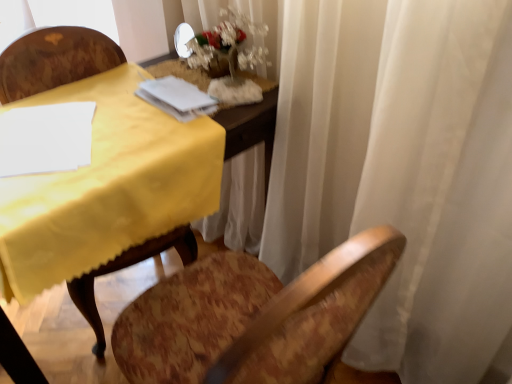
What do you see at coordinates (229, 44) in the screenshot? I see `white frosted glass vase at upper center` at bounding box center [229, 44].

Looking at this image, in order to face wooden chair at left, should I rotate leftwards or rightwards?

To face it directly, rotate left by 20.212 degrees.

At what (x,y) coordinates should I click in order to perform the action: click on white frosted glass vase at upper center. Please return your answer as a coordinate pair (x, y). Image resolution: width=512 pixels, height=384 pixels. Looking at the image, I should click on (229, 44).

Is white paper at upper center looking in the opposite direction of white frosted glass vase at upper center?

Yes, white paper at upper center is facing away from white frosted glass vase at upper center.

Looking at their sizes, would you say white paper at upper center is wider or thinner than white frosted glass vase at upper center?

white paper at upper center is thinner than white frosted glass vase at upper center.

Measure the distance between white paper at upper center and white frosted glass vase at upper center.

They are 5.42 inches apart.

In order to click on notebook beneath the white frosted glass vase at upper center (from a real-world perspective) in this screenshot , I will do `click(177, 98)`.

Which object is closer to the camera taking this photo, white frosted glass vase at upper center or white paper at upper center?

white paper at upper center is closer to the camera.

Is white frosted glass vase at upper center to the right of white paper at upper center from the viewer's perspective?

Yes, white frosted glass vase at upper center is to the right of white paper at upper center.

Find the location of a particular element. Image resolution: width=512 pixels, height=384 pixels. chair to the left of white frosted glass vase at upper center is located at coordinates (54, 60).

From a real-world perspective, is wooden chair at left below white frosted glass vase at upper center?

Yes, from a real-world perspective, wooden chair at left is beneath white frosted glass vase at upper center.

Would you say wooden chair at left is inside or outside white frosted glass vase at upper center?

wooden chair at left cannot be found inside white frosted glass vase at upper center.

Considering the positions of objects white paper at upper center and wooden chair at left in the image provided, who is more to the left, white paper at upper center or wooden chair at left?

wooden chair at left is more to the left.

Does white paper at upper center turn towards wooden chair at left?

Yes, white paper at upper center is aimed at wooden chair at left.

Is white paper at upper center taller or shorter than wooden chair at left?

Considering their sizes, white paper at upper center has less height than wooden chair at left.

Is white paper at upper center bigger than wooden chair at left?

No, white paper at upper center is not bigger than wooden chair at left.

Is there a large distance between white frosted glass vase at upper center and wooden chair at left?

No, there isn't a large distance between white frosted glass vase at upper center and wooden chair at left.

From the image's perspective, between white frosted glass vase at upper center and wooden chair at left, who is located below?

wooden chair at left is shown below in the image.

Considering their positions, is white frosted glass vase at upper center located in front of or behind wooden chair at left?

white frosted glass vase at upper center is behind wooden chair at left.

Is wooden chair at left at the back of white frosted glass vase at upper center?

No, white frosted glass vase at upper center is not facing the opposite direction of wooden chair at left.

Would you say white paper at upper center is part of wooden chair at left's contents?

That's incorrect, white paper at upper center is not inside wooden chair at left.

Could you tell me if wooden chair at left is facing white paper at upper center?

No, wooden chair at left is not turned towards white paper at upper center.

Looking at this image, is wooden chair at left positioned in front of white paper at upper center?

Yes, wooden chair at left is closer to the camera.

Identify the location of floral arrangement behind the white paper at upper center. The height and width of the screenshot is (384, 512). (229, 44).

This screenshot has width=512, height=384. What are the coordinates of `floral arrangement above the white paper at upper center (from the image's perspective)` in the screenshot? It's located at (229, 44).

When comparing their distances from white frosted glass vase at upper center, does wooden chair at left or white paper at upper center seem closer?

Among the two, white paper at upper center is located nearer to white frosted glass vase at upper center.

Based on the photo, estimate the real-world distances between objects in this image. Which object is further from white paper at upper center, white frosted glass vase at upper center or wooden chair at left?

wooden chair at left lies further to white paper at upper center than the other object.

Looking at the image, which one is located closer to white frosted glass vase at upper center, white paper at upper center or wooden chair at left?

white paper at upper center is closer to white frosted glass vase at upper center.

When comparing their distances from wooden chair at left, does white frosted glass vase at upper center or white paper at upper center seem closer?

white paper at upper center is positioned closer to the anchor wooden chair at left.

Estimate the real-world distances between objects in this image. Which object is further from wooden chair at left, white paper at upper center or white frosted glass vase at upper center?

white frosted glass vase at upper center lies further to wooden chair at left than the other object.

Considering their positions, is wooden chair at left positioned further to white paper at upper center than white frosted glass vase at upper center?

The object further to white paper at upper center is wooden chair at left.

Where is `notebook between white frosted glass vase at upper center and wooden chair at left in the vertical direction`? notebook between white frosted glass vase at upper center and wooden chair at left in the vertical direction is located at coordinates (177, 98).